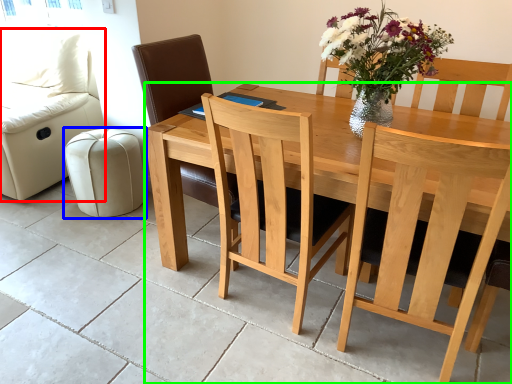
Question: Estimate the real-world distances between objects in this image. Which object is farther from couch (highlighted by a red box), stool (highlighted by a blue box) or table (highlighted by a green box)?

Choices:
 (A) stool
 (B) table

Answer: (B)